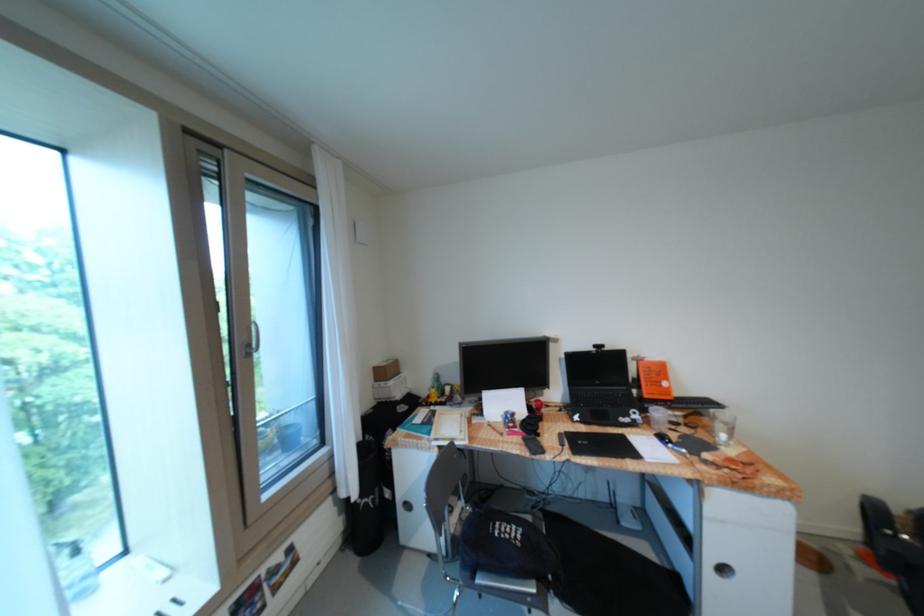
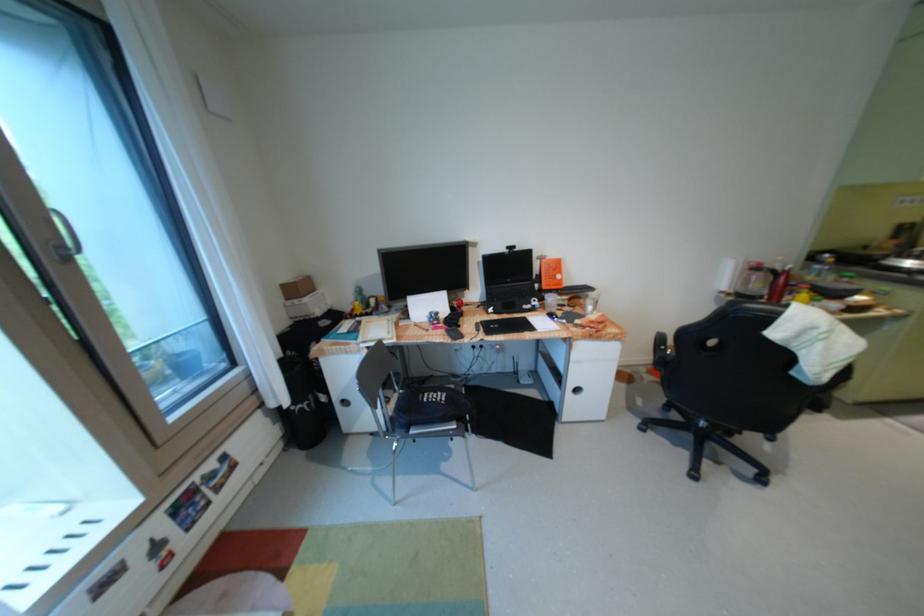
Which direction would the cameraman need to move to produce the second image?

The cameraman moved toward right, backward.